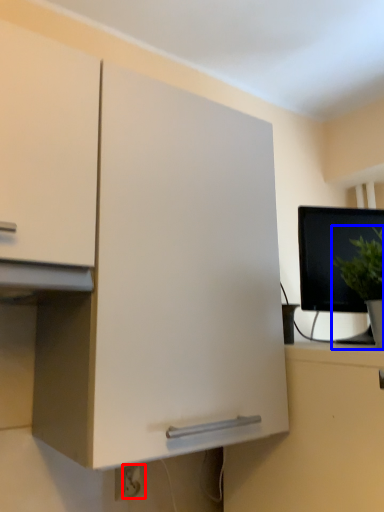
Question: Which of the following is the closest to the observer, electric outlet (highlighted by a red box) or houseplant (highlighted by a blue box)?

Choices:
 (A) electric outlet
 (B) houseplant

Answer: (B)